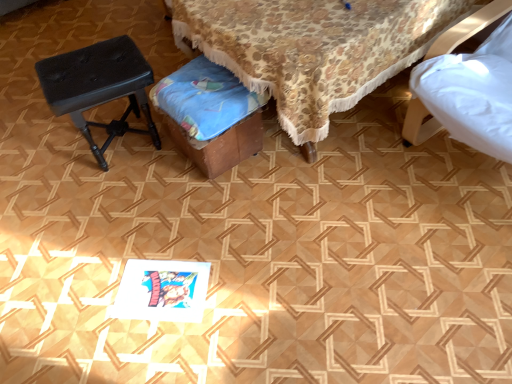
At what (x,y) coordinates should I click in order to perform the action: click on free space in front of black leather stool at left. Please return your answer as a coordinate pair (x, y). This screenshot has width=512, height=384. Looking at the image, I should click on (116, 199).